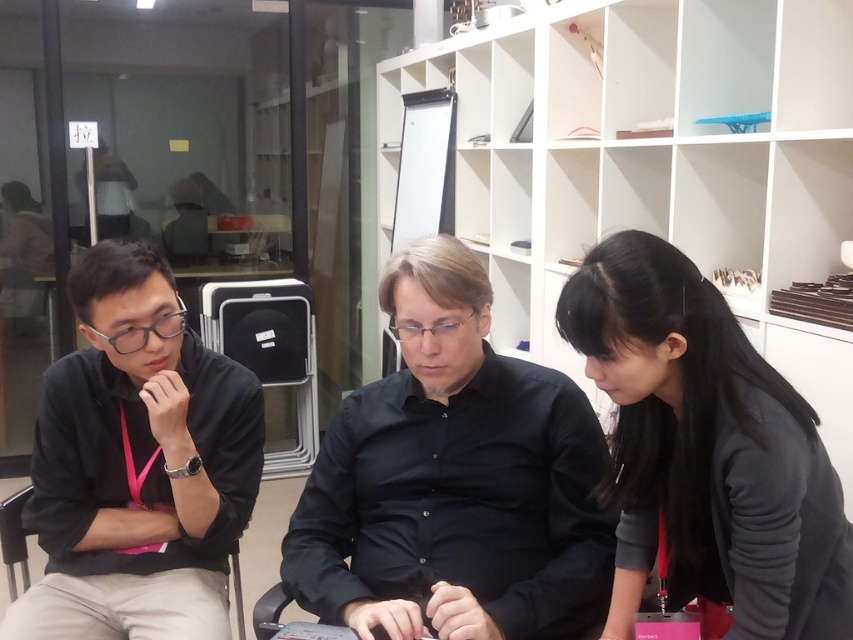
Based on the photo, who is higher up, black matte hair at lower right or black matte shirt at left?

black matte hair at lower right is higher up.

Who is more distant from viewer, (625, 342) or (91, 518)?

The point (91, 518) is more distant.

Find the location of a particular element. This screenshot has width=853, height=640. black matte hair at lower right is located at coordinates [706, 452].

Does black matte hair at lower right appear over black fabric chair at left?

Indeed, black matte hair at lower right is positioned over black fabric chair at left.

Between black matte hair at lower right and black fabric chair at left, which one is positioned higher?

Positioned higher is black matte hair at lower right.

Where is `black matte hair at lower right`? The width and height of the screenshot is (853, 640). black matte hair at lower right is located at coordinates (706, 452).

What are the coordinates of `black matte hair at lower right` in the screenshot? It's located at (706, 452).

Is black matte shirt at center above black matte shirt at left?

Correct, black matte shirt at center is located above black matte shirt at left.

Is the position of black matte shirt at center less distant than that of black matte shirt at left?

Yes, it is in front of black matte shirt at left.

Who is more forward, (x=576, y=483) or (x=115, y=336)?

Point (x=576, y=483) is more forward.

Identify the location of black matte shirt at center. This screenshot has width=853, height=640. [x=453, y=481].